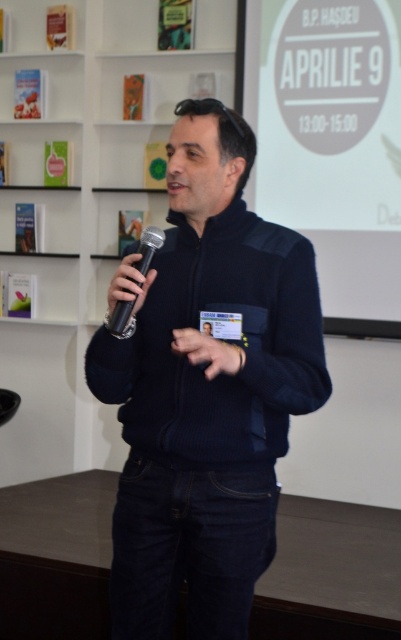
Between dark blue sweater at center and white matte projection screen at upper center, which one appears on the right side from the viewer's perspective?

From the viewer's perspective, white matte projection screen at upper center appears more on the right side.

Which is in front, point (131, 636) or point (322, 161)?

Point (131, 636) is in front.

Locate an element on the screen. The image size is (401, 640). dark blue sweater at center is located at coordinates (206, 388).

Who is taller, dark blue sweater at center or white matte bookshelf at upper left?

white matte bookshelf at upper left

Is dark blue sweater at center wider than white matte bookshelf at upper left?

In fact, dark blue sweater at center might be narrower than white matte bookshelf at upper left.

What do you see at coordinates (206, 388) in the screenshot?
I see `dark blue sweater at center` at bounding box center [206, 388].

Identify the location of dark blue sweater at center. (206, 388).

Where is `white matte projection screen at upper center`? This screenshot has width=401, height=640. white matte projection screen at upper center is located at coordinates (330, 145).

Between white matte projection screen at upper center and black matte microphone at left, which one appears on the left side from the viewer's perspective?

black matte microphone at left

Between point (259, 49) and point (111, 314), which one is positioned behind?

The point (259, 49) is behind.

Locate an element on the screen. The height and width of the screenshot is (640, 401). white matte projection screen at upper center is located at coordinates (330, 145).